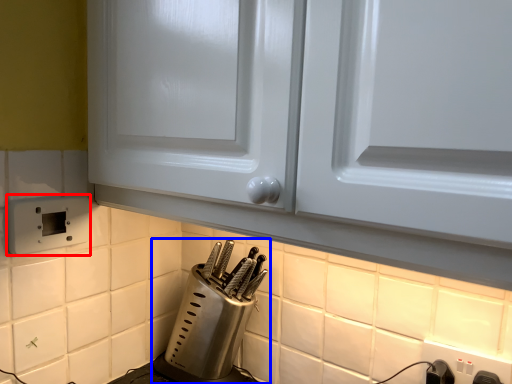
Question: Which point is further to the camera, electric outlet (highlighted by a red box) or kitchen appliance (highlighted by a blue box)?

Choices:
 (A) electric outlet
 (B) kitchen appliance

Answer: (B)